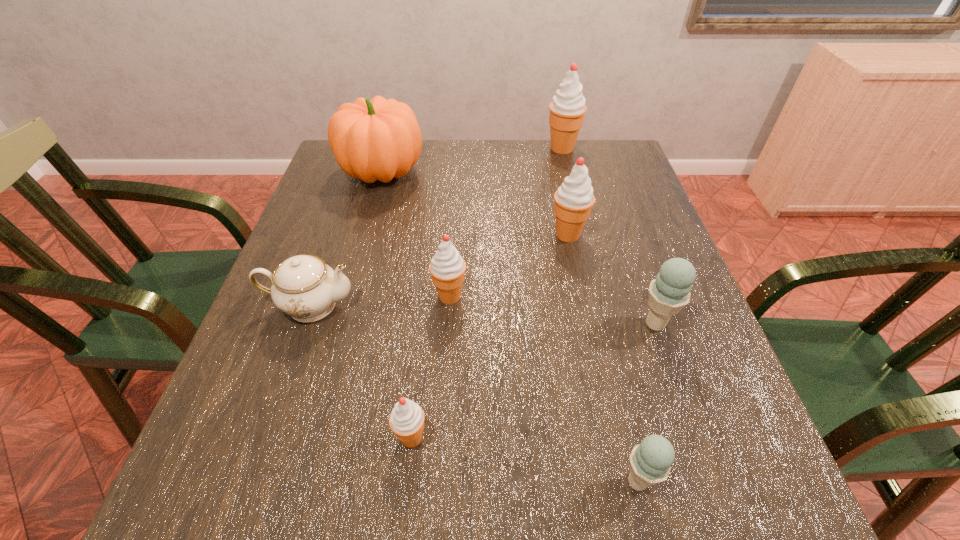
The height and width of the screenshot is (540, 960). In order to click on the tallest object in this screenshot , I will do `click(567, 109)`.

Locate an element on the screen. The image size is (960, 540). the tallest ice cream is located at coordinates (567, 109).

Identify the location of orange pumpkin. The width and height of the screenshot is (960, 540). (378, 139).

Where is `the third smallest red icecream`? the third smallest red icecream is located at coordinates (574, 199).

This screenshot has height=540, width=960. In order to click on the second farthest ice cream in this screenshot , I will do `click(574, 199)`.

The height and width of the screenshot is (540, 960). I want to click on the third biggest red icecream, so click(447, 267).

Where is `the right blue ice cream`? This screenshot has height=540, width=960. the right blue ice cream is located at coordinates (670, 291).

Image resolution: width=960 pixels, height=540 pixels. Find the location of `the rightmost ice cream`. the rightmost ice cream is located at coordinates (670, 291).

In order to click on chinaware in this screenshot , I will do `click(303, 286)`.

Image resolution: width=960 pixels, height=540 pixels. I want to click on the second nearest ice cream, so click(x=406, y=420).